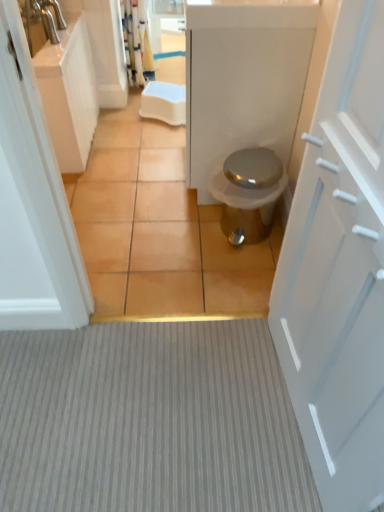
Question: Is brown tile at center looking in the opposite direction of white matte door at right?

Choices:
 (A) no
 (B) yes

Answer: (A)

Question: Is brown tile at center shorter than white matte door at right?

Choices:
 (A) no
 (B) yes

Answer: (B)

Question: Can white matte door at right be found inside brown tile at center?

Choices:
 (A) yes
 (B) no

Answer: (B)

Question: Is brown tile at center at the left side of white matte door at right?

Choices:
 (A) no
 (B) yes

Answer: (B)

Question: Does brown tile at center come behind white matte door at right?

Choices:
 (A) no
 (B) yes

Answer: (B)

Question: Is point click(x=231, y=189) positioned closer to the camera than point click(x=132, y=132)?

Choices:
 (A) closer
 (B) farther

Answer: (A)

Question: From a real-world perspective, is satin silver trash can at center above or below brown tile at center?

Choices:
 (A) below
 (B) above

Answer: (B)

Question: Is satin silver trash can at center wider or thinner than brown tile at center?

Choices:
 (A) thin
 (B) wide

Answer: (A)

Question: Considering the positions of satin silver trash can at center and brown tile at center in the image, is satin silver trash can at center bigger or smaller than brown tile at center?

Choices:
 (A) small
 (B) big

Answer: (A)

Question: Is point (72, 139) positioned closer to the camera than point (165, 322)?

Choices:
 (A) closer
 (B) farther

Answer: (B)

Question: Based on their sizes in the image, would you say white glossy cabinet at left is bigger or smaller than gray textured carpet at center?

Choices:
 (A) big
 (B) small

Answer: (A)

Question: In terms of width, does white glossy cabinet at left look wider or thinner when compared to gray textured carpet at center?

Choices:
 (A) thin
 (B) wide

Answer: (B)

Question: From a real-world perspective, is white glossy cabinet at left above or below gray textured carpet at center?

Choices:
 (A) below
 (B) above

Answer: (B)

Question: Is white matte door at right in front of or behind brown tile at center in the image?

Choices:
 (A) front
 (B) behind

Answer: (A)

Question: Is point (354, 175) positioned closer to the camera than point (112, 118)?

Choices:
 (A) closer
 (B) farther

Answer: (A)